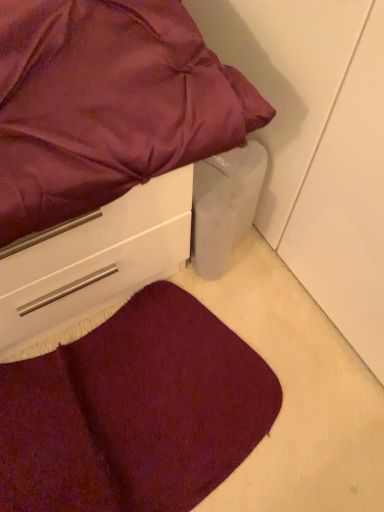
Describe the element at coordinates (103, 148) in the screenshot. I see `satin purple bed at upper left` at that location.

Find the location of a particular element. satin purple bed at upper left is located at coordinates (103, 148).

What do you see at coordinates (134, 411) in the screenshot? The image size is (384, 512). I see `burgundy carpet at lower left` at bounding box center [134, 411].

Locate an element on the screen. The image size is (384, 512). burgundy carpet at lower left is located at coordinates (134, 411).

Locate an element on the screen. satin purple bed at upper left is located at coordinates (103, 148).

Would you say satin purple bed at upper left is to the left or to the right of burgundy carpet at lower left in the picture?

satin purple bed at upper left is to the left of burgundy carpet at lower left.

Who is more distant, satin purple bed at upper left or burgundy carpet at lower left?

burgundy carpet at lower left.

Considering the positions of point (145, 263) and point (94, 360), is point (145, 263) closer or farther from the camera than point (94, 360)?

Point (145, 263) is positioned closer to the camera compared to point (94, 360).

From the image's perspective, is satin purple bed at upper left above burgundy carpet at lower left?

Yes, from the image's perspective, satin purple bed at upper left is on top of burgundy carpet at lower left.

From a real-world perspective, between satin purple bed at upper left and burgundy carpet at lower left, who is vertically higher?

satin purple bed at upper left.

Is satin purple bed at upper left wider or thinner than burgundy carpet at lower left?

In the image, satin purple bed at upper left appears to be more narrow than burgundy carpet at lower left.

Who is taller, satin purple bed at upper left or burgundy carpet at lower left?

With more height is satin purple bed at upper left.

Can you confirm if satin purple bed at upper left is smaller than burgundy carpet at lower left?

No, satin purple bed at upper left is not smaller than burgundy carpet at lower left.

Based on the photo, choose the correct answer: Is satin purple bed at upper left inside burgundy carpet at lower left or outside it?

satin purple bed at upper left is located beyond the bounds of burgundy carpet at lower left.

Is satin purple bed at upper left far away from burgundy carpet at lower left?

No.

Is satin purple bed at upper left facing towards burgundy carpet at lower left?

No.

How much distance is there between satin purple bed at upper left and burgundy carpet at lower left?

satin purple bed at upper left is 12.85 inches from burgundy carpet at lower left.

The height and width of the screenshot is (512, 384). In order to click on bed on the left of burgundy carpet at lower left in this screenshot , I will do `click(103, 148)`.

Considering the positions of objects burgundy carpet at lower left and satin purple bed at upper left in the image provided, who is more to the left, burgundy carpet at lower left or satin purple bed at upper left?

satin purple bed at upper left.

Which is in front, burgundy carpet at lower left or satin purple bed at upper left?

satin purple bed at upper left is closer to the camera.

Is point (158, 316) positioned in front of point (6, 222)?

No, (158, 316) is behind (6, 222).

From the image's perspective, relative to satin purple bed at upper left, is burgundy carpet at lower left above or below?

burgundy carpet at lower left is situated lower than satin purple bed at upper left in the image.

From a real-world perspective, between burgundy carpet at lower left and satin purple bed at upper left, who is vertically lower?

burgundy carpet at lower left is physically lower.

Can you confirm if burgundy carpet at lower left is wider than satin purple bed at upper left?

Yes, burgundy carpet at lower left is wider than satin purple bed at upper left.

Which of these two, burgundy carpet at lower left or satin purple bed at upper left, stands shorter?

Standing shorter between the two is burgundy carpet at lower left.

Considering the sizes of objects burgundy carpet at lower left and satin purple bed at upper left in the image provided, who is smaller, burgundy carpet at lower left or satin purple bed at upper left?

burgundy carpet at lower left.

Is burgundy carpet at lower left spatially inside satin purple bed at upper left, or outside of it?

burgundy carpet at lower left is spatially situated outside satin purple bed at upper left.

Is burgundy carpet at lower left next to satin purple bed at upper left and touching it?

No, burgundy carpet at lower left is not beside satin purple bed at upper left.

Is satin purple bed at upper left at the back of burgundy carpet at lower left?

No, burgundy carpet at lower left's orientation is not away from satin purple bed at upper left.

How many degrees apart are the facing directions of burgundy carpet at lower left and satin purple bed at upper left?

They differ by 1.05 degrees in their facing directions.

You are a GUI agent. You are given a task and a screenshot of the screen. Output one action in this format:
    pyautogui.click(x=<x>, y=<y>)
    Task: Click on the mat below the satin purple bed at upper left (from the image's perspective)
    
    Given the screenshot: What is the action you would take?
    pyautogui.click(x=134, y=411)

Image resolution: width=384 pixels, height=512 pixels. Identify the location of mat on the right of satin purple bed at upper left. (134, 411).

You are a GUI agent. You are given a task and a screenshot of the screen. Output one action in this format:
    pyautogui.click(x=<x>, y=<y>)
    Task: Click on the bed in front of the burgundy carpet at lower left
    This screenshot has height=512, width=384.
    Given the screenshot: What is the action you would take?
    pyautogui.click(x=103, y=148)